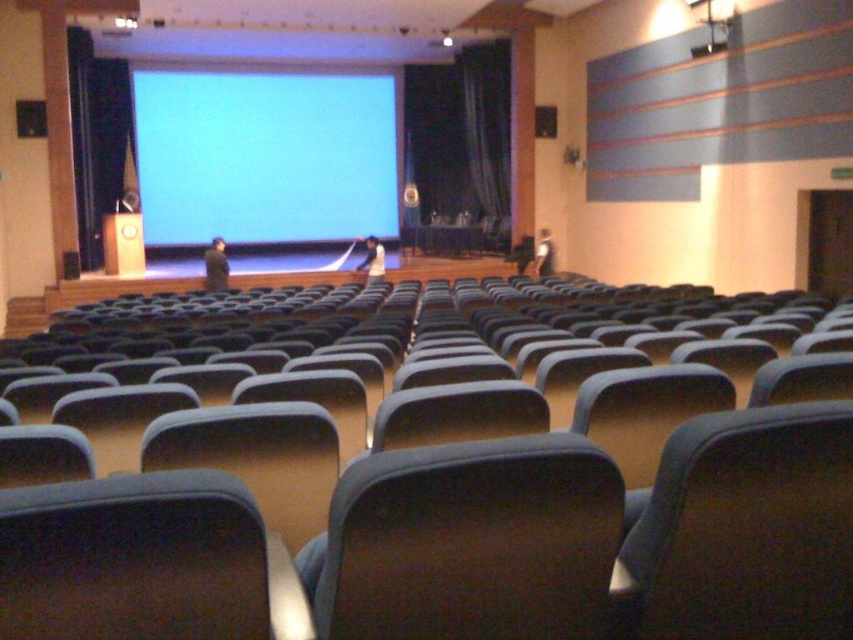
Question: Which point is closer to the camera taking this photo?

Choices:
 (A) (465, 118)
 (B) (196, 189)
 (C) (668, 593)

Answer: (C)

Question: Is blue matte projection screen at center behind blue fabric curtain at center?

Choices:
 (A) yes
 (B) no

Answer: (A)

Question: Which object is positioned closest to the blue matte projection screen at center?

Choices:
 (A) dark fabric chair at lower right
 (B) dark fabric chair at center
 (C) blue fabric chair at center

Answer: (C)

Question: Which point appears closest to the camera in this image?

Choices:
 (A) (311, 456)
 (B) (496, 109)
 (C) (242, 193)

Answer: (A)

Question: Is the position of dark fabric chair at lower right more distant than that of blue matte projection screen at center?

Choices:
 (A) yes
 (B) no

Answer: (B)

Question: Can you confirm if dark fabric chair at lower right is bigger than blue fabric curtain at center?

Choices:
 (A) no
 (B) yes

Answer: (A)